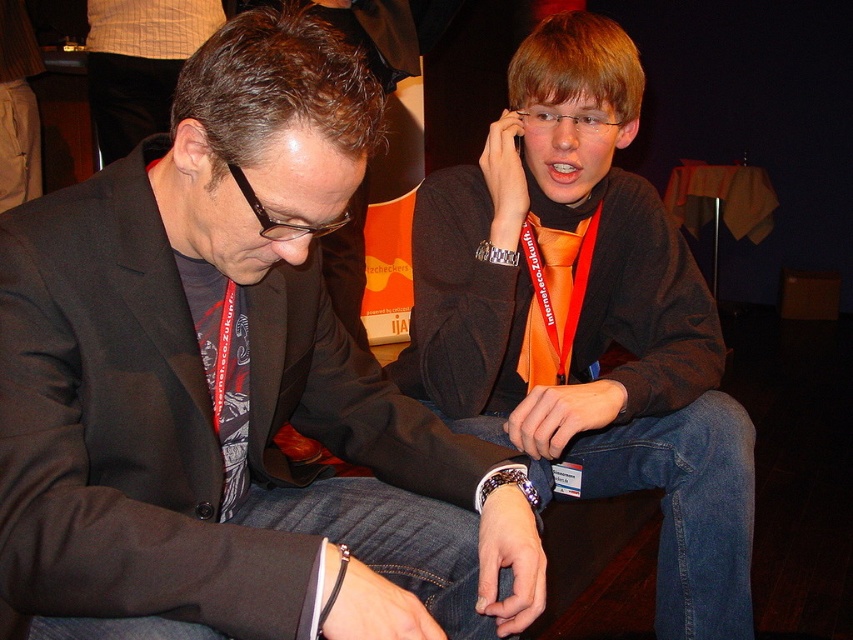
You are a photographer trying to capture a closeup shot of the orange satin tie at center. You have a camera that can only focus on objects within 1 meter. Since you are currently standing 1.5 meters away from the matte black jacket at center, can you still take the photo?

The matte black jacket at center is closer to the viewer than the orange satin tie at center. Since you are 1.5 meters away from the matte black jacket at center, the orange satin tie at center is further away. Therefore, the distance to the orange satin tie at center would be more than 1.5 meters, so the camera cannot focus on it.

Looking at this image, based on the scene description, where is the orange fabric tie at center located in the image?

The orange fabric tie at center is located at point [585,317] in the image.

Based on the coordinates provided, what is the object located at point (585, 317) in the image?

The orange fabric tie at center is located at point (585, 317).